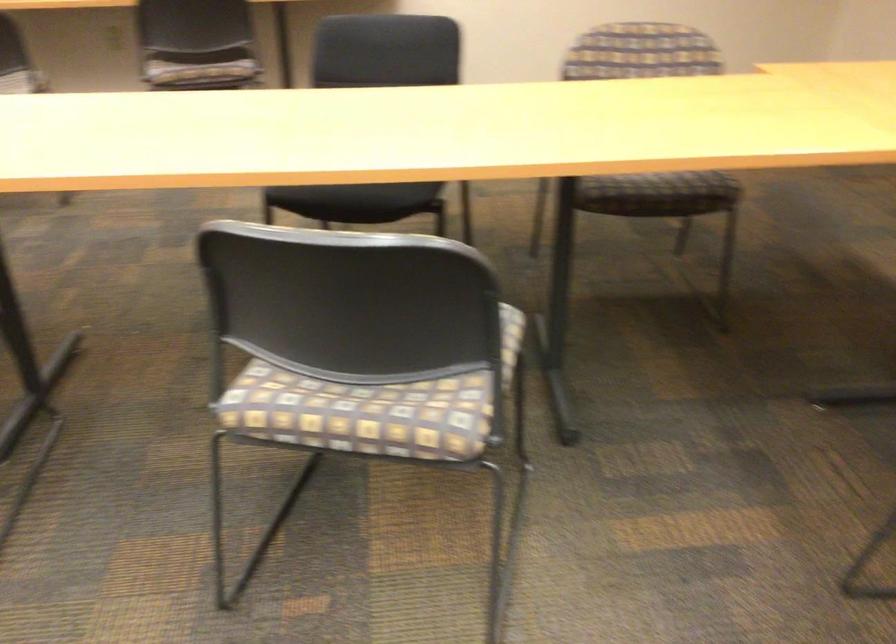
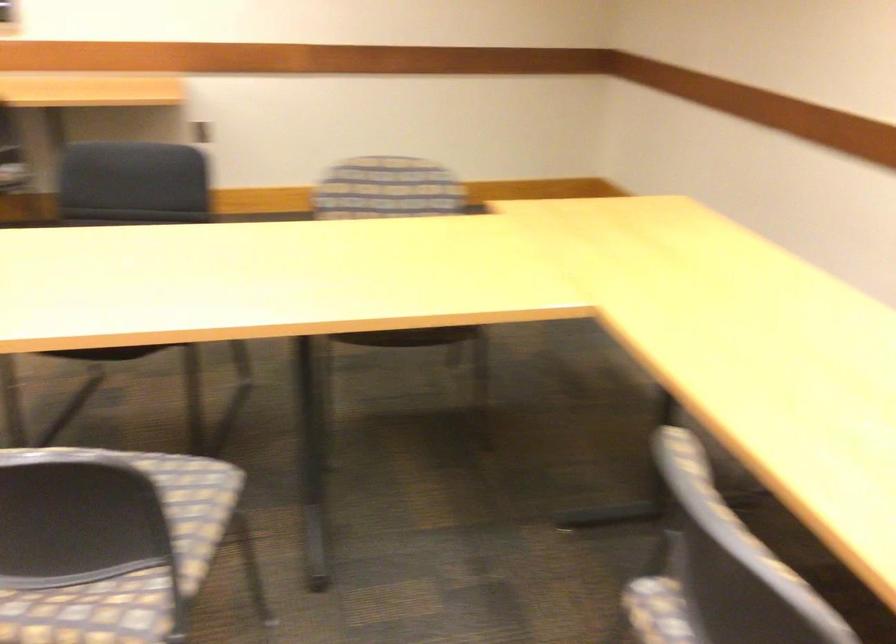
Question: I am providing you with two images of the same scene from different viewpoints. Please identify which objects are invisible in image2.

Choices:
 (A) dark chair sitting surface
 (B) black chair sitting surface
 (C) striped chair sitting surface
 (D) none of these

Answer: (D)